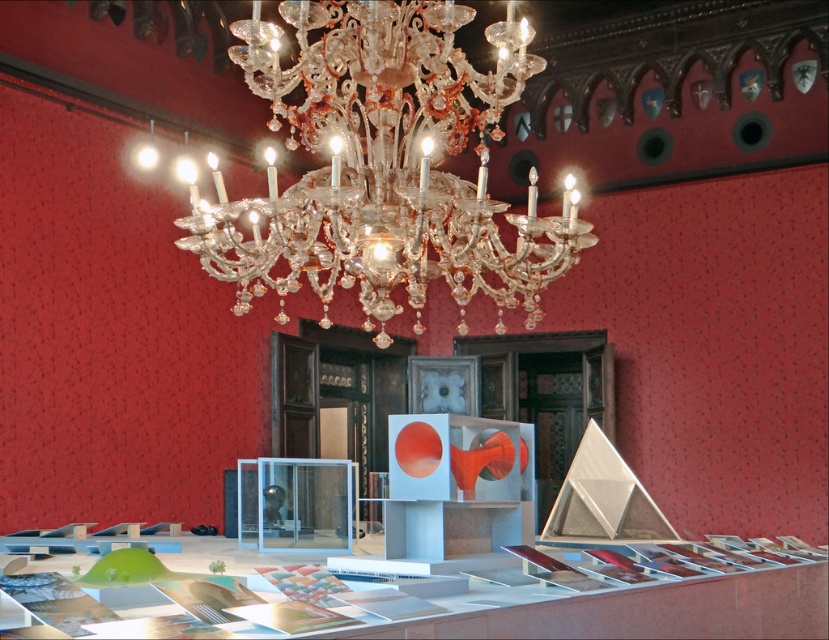
Where is `clear crystal chandelier at upper center`? The width and height of the screenshot is (829, 640). clear crystal chandelier at upper center is located at coordinates (385, 164).